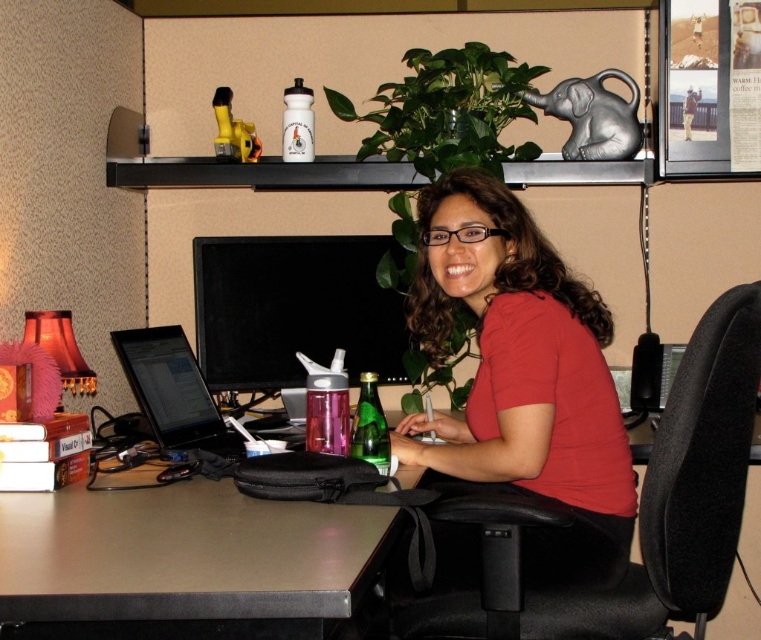
Question: Which point is farther to the camera?

Choices:
 (A) red matte shirt at center
 (B) metallic gray computer desk at lower left

Answer: (A)

Question: Observing the image, what is the correct spatial positioning of red matte shirt at center in reference to metallic gray computer desk at lower left?

Choices:
 (A) above
 (B) below

Answer: (A)

Question: Is red matte shirt at center wider than metallic gray computer desk at lower left?

Choices:
 (A) no
 (B) yes

Answer: (A)

Question: Is red matte shirt at center to the left of metallic gray computer desk at lower left from the viewer's perspective?

Choices:
 (A) yes
 (B) no

Answer: (B)